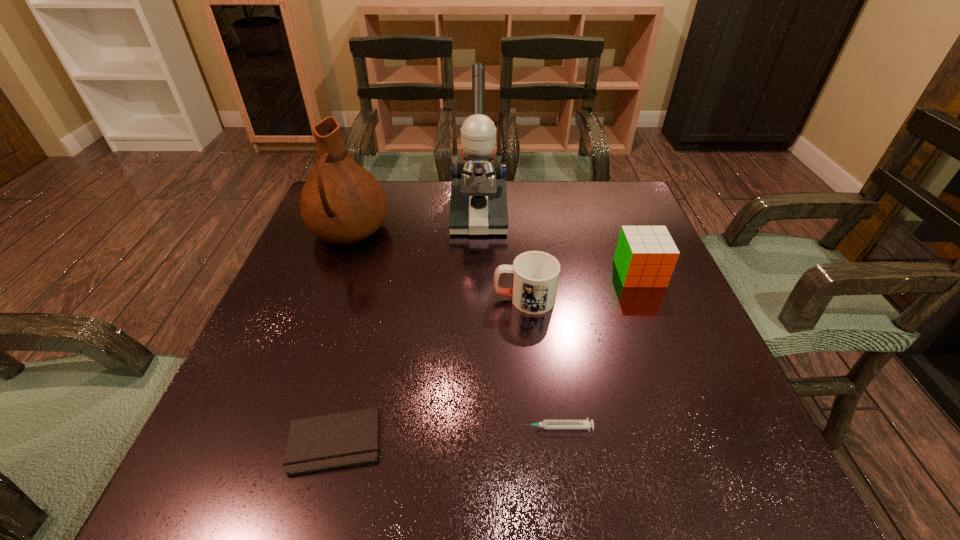
Locate an element on the screen. free space that is in between the microscope and the mug is located at coordinates (501, 257).

Image resolution: width=960 pixels, height=540 pixels. I want to click on vacant area that lies between the tallest object and the syringe, so click(516, 321).

Identify the location of unoccupied position between the cube and the pitcher. Image resolution: width=960 pixels, height=540 pixels. coord(494,252).

The image size is (960, 540). Find the location of `vacant region between the second tallest object and the second shortest object`. vacant region between the second tallest object and the second shortest object is located at coordinates 452,329.

Where is `free space that is in between the cube and the mug`? free space that is in between the cube and the mug is located at coordinates (582, 286).

At what (x,y) coordinates should I click in order to perform the action: click on unoccupied area between the microscope and the cube. Please return your answer as a coordinate pair (x, y). This screenshot has width=960, height=540. Looking at the image, I should click on (559, 244).

Identify the location of blank region between the cube and the microscope. (559, 244).

I want to click on vacant area between the tallest object and the mug, so click(501, 257).

Identify the location of vacant area between the shortest object and the tallest object. The width and height of the screenshot is (960, 540). (406, 328).

Where is `object that is the second closest to the second shortest object`? This screenshot has height=540, width=960. object that is the second closest to the second shortest object is located at coordinates (535, 278).